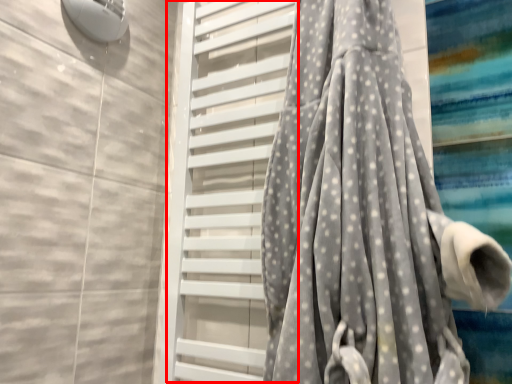
Question: In this image, where is screen door (annotated by the red box) located relative to curtain?

Choices:
 (A) left
 (B) right

Answer: (A)